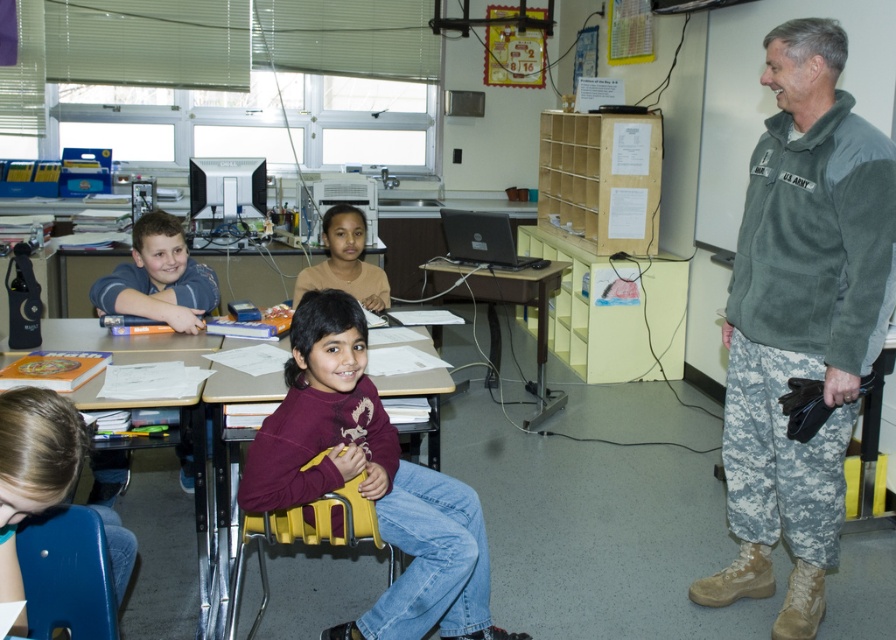
Question: Estimate the real-world distances between objects in this image. Which object is farther from the yellow plastic chair at center?

Choices:
 (A) blonde hair at lower left
 (B) brown wooden table at center
 (C) matte blue shirt at left
 (D) smooth skin face at center

Answer: (B)

Question: Is blonde hair at lower left to the left of brown wooden table at center from the viewer's perspective?

Choices:
 (A) no
 (B) yes

Answer: (B)

Question: In this image, where is matte blue shirt at left located relative to yellow plastic chair at center?

Choices:
 (A) below
 (B) above

Answer: (B)

Question: Among these objects, which one is nearest to the camera?

Choices:
 (A) brown wooden table at center
 (B) camouflage pants at right
 (C) yellow plastic chair at center

Answer: (C)

Question: Is maroon sweater at center positioned in front of blue denim jeans at left?

Choices:
 (A) yes
 (B) no

Answer: (A)

Question: Which of the following is the closest to the observer?

Choices:
 (A) blonde hair at lower left
 (B) yellow plastic chair at center

Answer: (A)